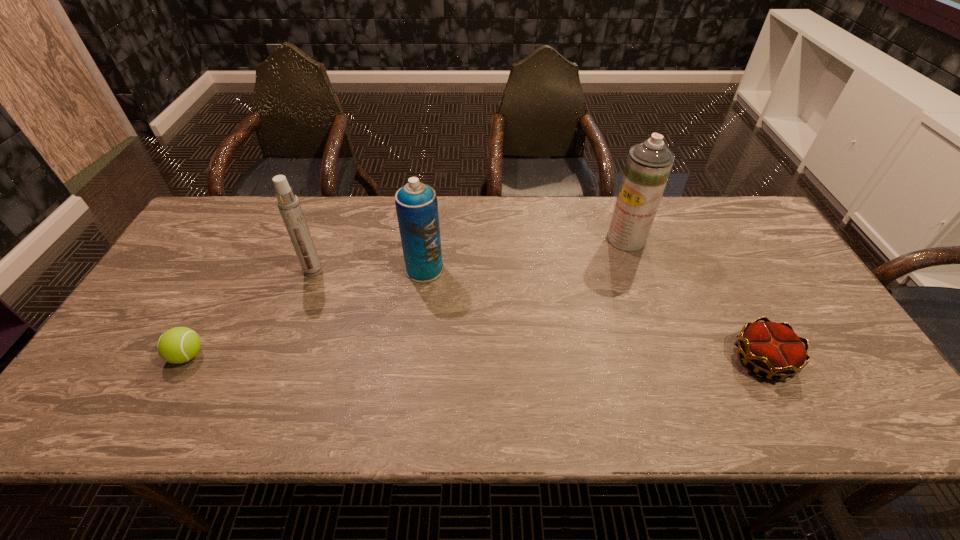
Find the location of a particular element. This screenshot has height=540, width=960. vacant space positioned 0.100m on the back of the rightmost object is located at coordinates (733, 305).

The image size is (960, 540). What are the coordinates of `object that is positioned at the far edge` in the screenshot? It's located at (648, 166).

Find the location of a particular element. Image resolution: width=960 pixels, height=540 pixels. object located at the left edge is located at coordinates (177, 345).

Where is `object located in the right edge section of the desktop`? Image resolution: width=960 pixels, height=540 pixels. object located in the right edge section of the desktop is located at coordinates (773, 348).

The image size is (960, 540). In order to click on vacant space at the far edge of the desktop in this screenshot , I will do `click(480, 230)`.

The image size is (960, 540). Identify the location of vacant space at the near edge. (636, 417).

The image size is (960, 540). In the image, there is a desktop. Identify the location of vacant space at the left edge. (115, 374).

The width and height of the screenshot is (960, 540). Find the location of `vacant space at the right edge of the desktop`. vacant space at the right edge of the desktop is located at coordinates (751, 248).

This screenshot has width=960, height=540. In the image, there is a desktop. Identify the location of vacant region at the far left corner. (242, 214).

Identify the location of unoccupied area between the leftmost aerosol can and the third object from left to right. The image size is (960, 540). (369, 270).